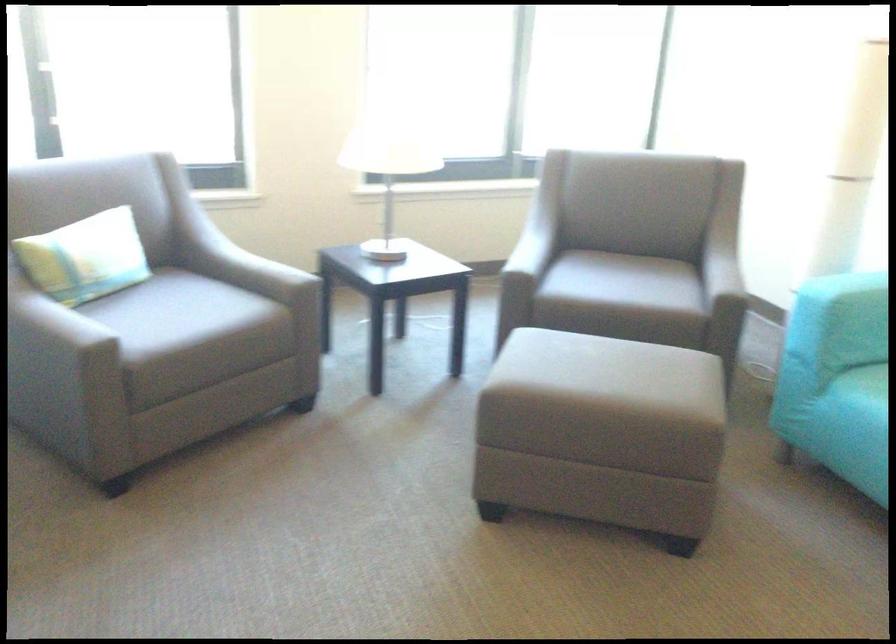
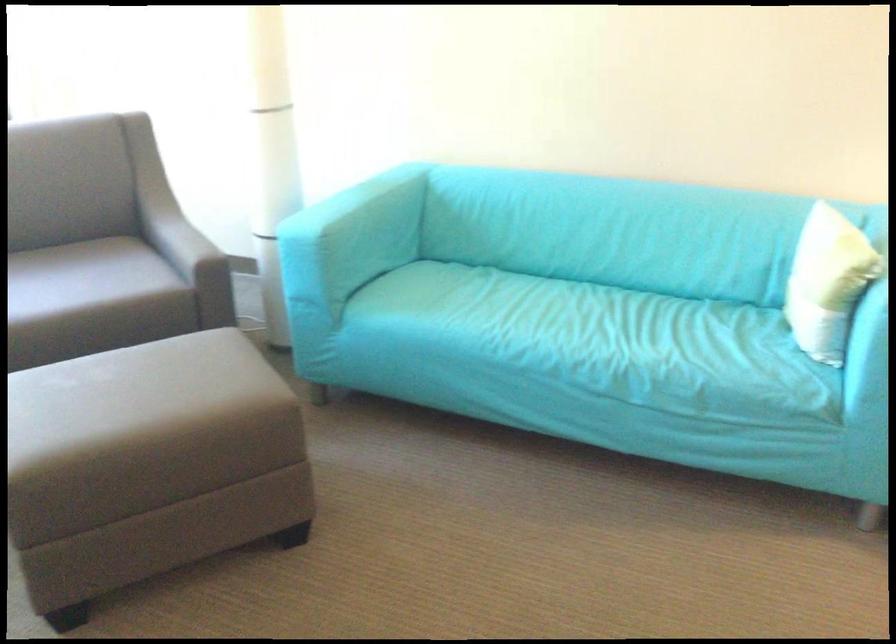
Where in the second image is the point corresponding to (x=719, y=288) from the first image?

(188, 251)